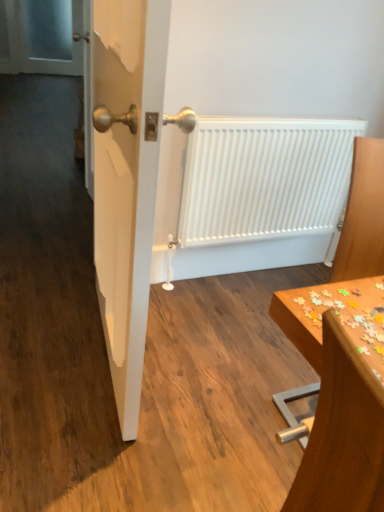
Find the location of a particular element. free space that is to the left of wooden table at right is located at coordinates (245, 398).